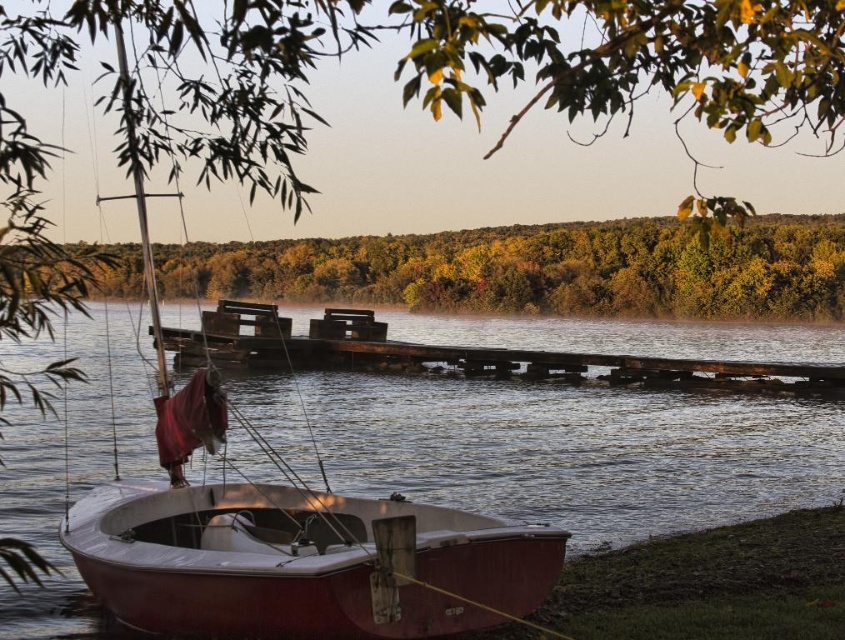
Is green leafy tree at upper center wider than wooden sailboat at lower left?

Yes, green leafy tree at upper center is wider than wooden sailboat at lower left.

Does green leafy tree at upper center have a smaller size compared to wooden sailboat at lower left?

Actually, green leafy tree at upper center might be larger than wooden sailboat at lower left.

The width and height of the screenshot is (845, 640). Describe the element at coordinates (461, 70) in the screenshot. I see `green leafy tree at upper center` at that location.

Locate an element on the screen. This screenshot has height=640, width=845. green leafy tree at upper center is located at coordinates (461, 70).

Can you confirm if green leafy tree at upper center is thinner than green leafy trees at upper center?

No, green leafy tree at upper center is not thinner than green leafy trees at upper center.

Who is taller, green leafy tree at upper center or green leafy trees at upper center?

green leafy tree at upper center is taller.

Which is in front, point (95, 22) or point (118, 272)?

Point (95, 22) is more forward.

This screenshot has height=640, width=845. Identify the location of green leafy tree at upper center. (461, 70).

Between green leafy tree at upper center and weathered wood dock at center, which one has less height?

Standing shorter between the two is weathered wood dock at center.

Does green leafy tree at upper center have a larger size compared to weathered wood dock at center?

Yes, green leafy tree at upper center is bigger than weathered wood dock at center.

Is point (104, 76) farther from camera compared to point (353, 314)?

No, it is not.

The width and height of the screenshot is (845, 640). Find the location of `green leafy tree at upper center`. green leafy tree at upper center is located at coordinates (461, 70).